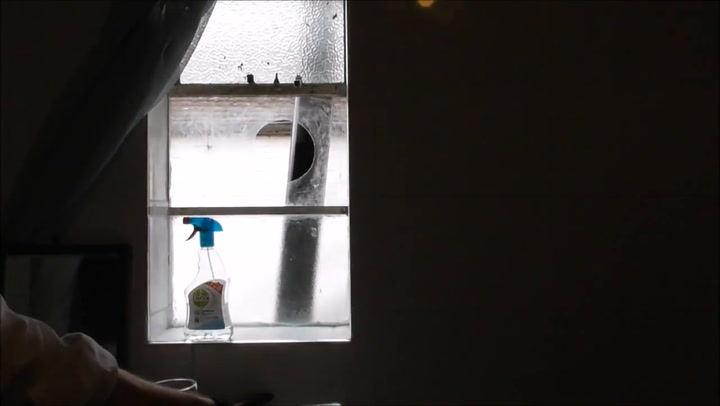
Locate an element on the screen. Image resolution: width=720 pixels, height=406 pixels. blue dispenser top is located at coordinates (204, 226).